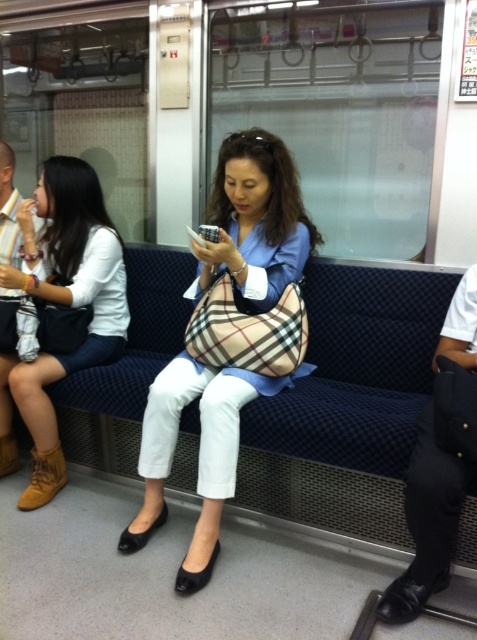
This screenshot has width=477, height=640. What do you see at coordinates (198, 452) in the screenshot? I see `plaid fabric handbag at center` at bounding box center [198, 452].

Between plaid fabric handbag at center and matte white blouse at upper left, which one is positioned higher?

Positioned higher is plaid fabric handbag at center.

Between point (228, 486) and point (22, 408), which one is positioned behind?

The point (22, 408) is more distant.

Where is `plaid fabric handbag at center`? plaid fabric handbag at center is located at coordinates (198, 452).

Between matte white blouse at upper left and brown leather coach at left, which one appears on the left side from the viewer's perspective?

brown leather coach at left is more to the left.

Can you confirm if matte white blouse at upper left is positioned to the left of brown leather coach at left?

No, matte white blouse at upper left is not to the left of brown leather coach at left.

Measure the distance between matte white blouse at upper left and camera.

matte white blouse at upper left and camera are 2.01 meters apart from each other.

Where is `matte white blouse at upper left`? Image resolution: width=477 pixels, height=640 pixels. matte white blouse at upper left is located at coordinates (61, 304).

Does plaid fabric handbag at center appear on the right side of brown leather coach at left?

Correct, you'll find plaid fabric handbag at center to the right of brown leather coach at left.

Does plaid fabric handbag at center have a greater height compared to brown leather coach at left?

No.

Which is in front, point (156, 436) or point (11, 241)?

Point (156, 436)

The image size is (477, 640). What are the coordinates of `plaid fabric handbag at center` in the screenshot? It's located at (198, 452).